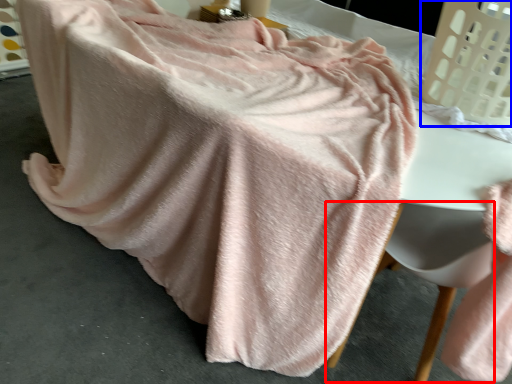
Question: Which point is closer to the camera, swivel chair (highlighted by a red box) or laundry basket (highlighted by a blue box)?

Choices:
 (A) swivel chair
 (B) laundry basket

Answer: (A)